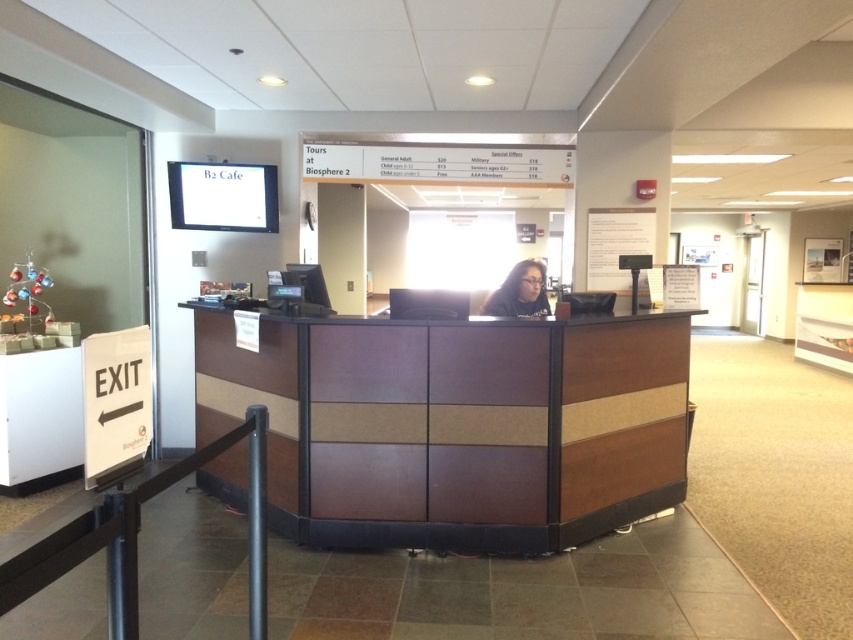
You are standing at point A located at coordinates point A at (575,432). You need to reach point B which is 3.65 meters away. Is there enough space to walk directly from point A to point B without any obstacles?

The distance between point A at (575,432) and point B is 3.65 meters. Since there are no obstacles mentioned in the scene description between them, you can walk directly to point B.